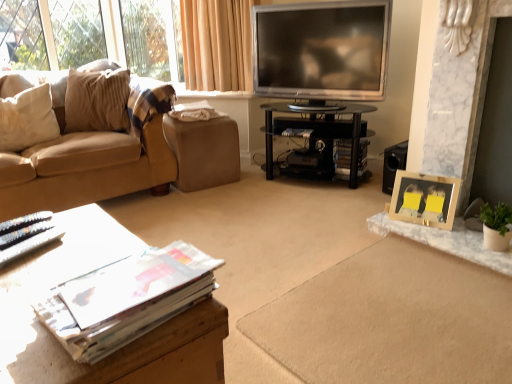
This screenshot has height=384, width=512. I want to click on vacant area that lies to the right of white glossy magazine at lower left, the 3th magazine positioned from the right, so click(x=84, y=237).